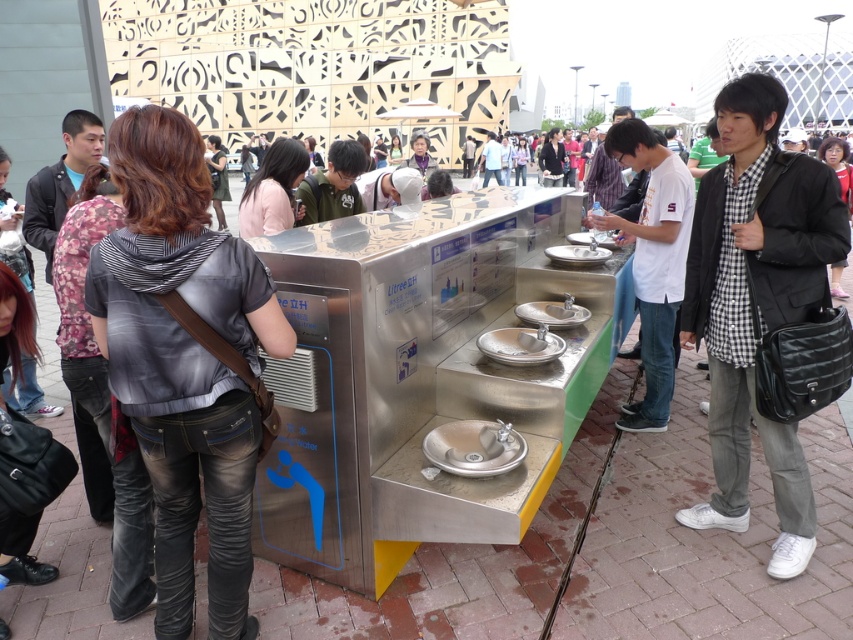
Question: Which point is farther to the camera?

Choices:
 (A) (178, 440)
 (B) (517, 340)
 (C) (761, 282)

Answer: (B)

Question: Where is stainless steel water fountain at center located in relation to denim jacket at center in the image?

Choices:
 (A) left
 (B) right

Answer: (B)

Question: Which of the following is the farthest from the observer?

Choices:
 (A) (328, 339)
 (B) (202, 435)
 (C) (795, 314)
 (D) (558, 340)

Answer: (D)

Question: Is denim jacket at center further to the viewer compared to satin silver sink at center?

Choices:
 (A) yes
 (B) no

Answer: (B)

Question: Does checkered shirt at center come in front of satin silver sink at center?

Choices:
 (A) no
 (B) yes

Answer: (B)

Question: Estimate the real-world distances between objects in this image. Which object is farther from the stainless steel water fountain at center?

Choices:
 (A) denim jacket at center
 (B) satin silver sink at center
 (C) checkered shirt at center

Answer: (C)